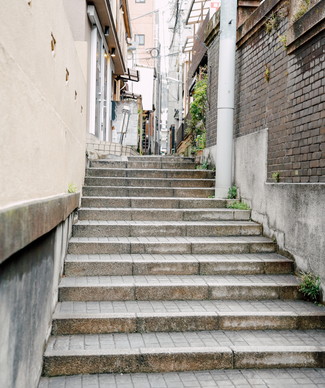
Image resolution: width=325 pixels, height=388 pixels. I want to click on concrete tile, so click(105, 344), click(122, 344), click(136, 343), click(152, 344).